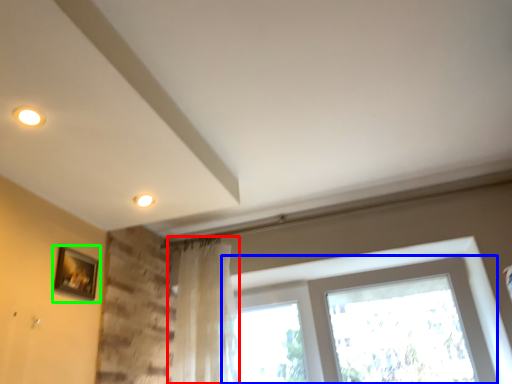
Question: Which object is positioned farthest from curtain (highlighted by a red box)? Select from window (highlighted by a blue box) and picture frame (highlighted by a green box).

Choices:
 (A) window
 (B) picture frame

Answer: (B)